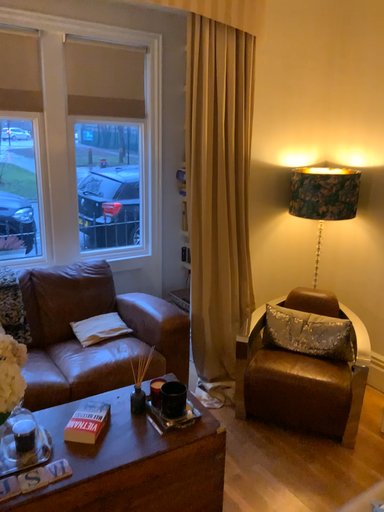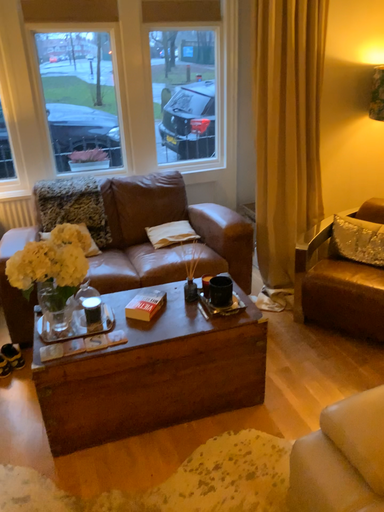
Question: Which way did the camera rotate in the video?

Choices:
 (A) rotated upward
 (B) rotated downward

Answer: (B)